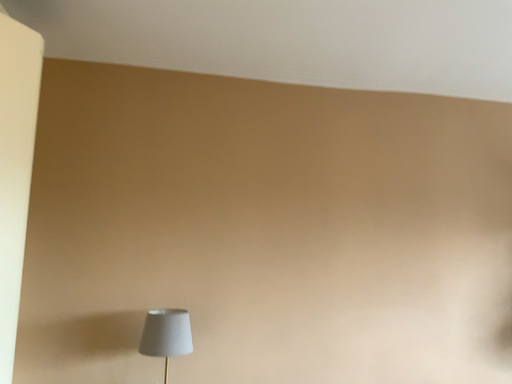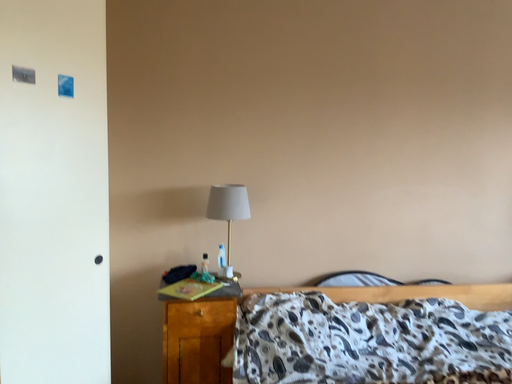
Question: How did the camera likely rotate when shooting the video?

Choices:
 (A) rotated left
 (B) rotated right

Answer: (A)